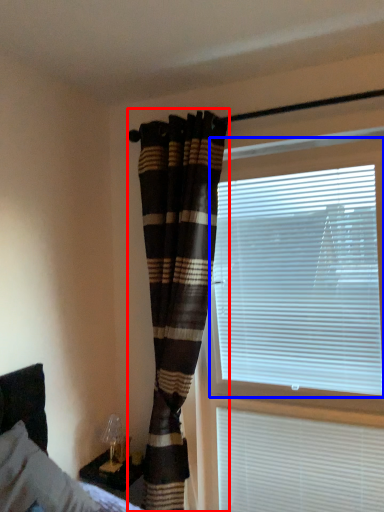
Question: Which of the following is the closest to the observer, curtain (highlighted by a red box) or window blind (highlighted by a blue box)?

Choices:
 (A) curtain
 (B) window blind

Answer: (B)